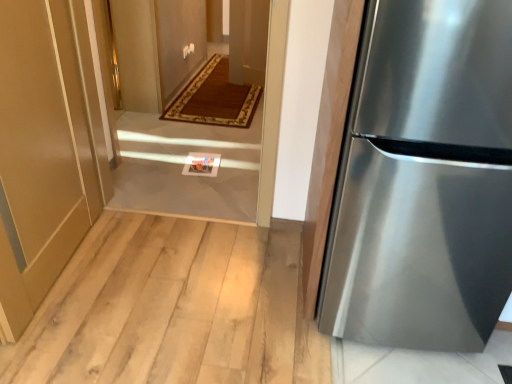
The width and height of the screenshot is (512, 384). Describe the element at coordinates (47, 147) in the screenshot. I see `matte gold door at lower left` at that location.

Image resolution: width=512 pixels, height=384 pixels. Find the location of `matte gold door at lower left`. matte gold door at lower left is located at coordinates (47, 147).

How many degrees apart are the facing directions of matte gold door at lower left and stainless steel refrigerator at right?

The angle between the facing direction of matte gold door at lower left and the facing direction of stainless steel refrigerator at right is 90.8 degrees.

In terms of size, does matte gold door at lower left appear bigger or smaller than stainless steel refrigerator at right?

In the image, matte gold door at lower left appears to be smaller than stainless steel refrigerator at right.

Consider the image. Is matte gold door at lower left not near stainless steel refrigerator at right?

Yes, matte gold door at lower left is far from stainless steel refrigerator at right.

Is the depth of matte gold door at lower left less than that of stainless steel refrigerator at right?

No, it is not.

Is white tile floor at center thinner than matte gold door at lower left?

In fact, white tile floor at center might be wider than matte gold door at lower left.

Is white tile floor at center taller than matte gold door at lower left?

In fact, white tile floor at center may be shorter than matte gold door at lower left.

Between stainless steel refrigerator at right and white tile floor at center, which one appears on the left side from the viewer's perspective?

white tile floor at center is more to the left.

Which of these two, stainless steel refrigerator at right or white tile floor at center, is thinner?

white tile floor at center is thinner.

Is stainless steel refrigerator at right facing away from white tile floor at center?

No, white tile floor at center is not at the back of stainless steel refrigerator at right.

Who is taller, stainless steel refrigerator at right or white tile floor at center?

Standing taller between the two is stainless steel refrigerator at right.

Is stainless steel refrigerator at right shorter than matte gold door at lower left?

Incorrect, the height of stainless steel refrigerator at right does not fall short of that of matte gold door at lower left.

Is matte gold door at lower left surrounded by stainless steel refrigerator at right?

No, matte gold door at lower left is located outside of stainless steel refrigerator at right.

Identify the location of door above the stainless steel refrigerator at right (from the image's perspective). (47, 147).

What are the coordinates of `refrigerator in front of the white tile floor at center` in the screenshot? It's located at (424, 180).

How different are the orientations of white tile floor at center and stainless steel refrigerator at right in degrees?

0.274 degrees.

Does white tile floor at center touch stainless steel refrigerator at right?

No, white tile floor at center is not touching stainless steel refrigerator at right.

Can you confirm if matte gold door at lower left is shorter than white tile floor at center?

Incorrect, the height of matte gold door at lower left does not fall short of that of white tile floor at center.

Is matte gold door at lower left positioned beyond the bounds of white tile floor at center?

Yes, matte gold door at lower left is located beyond the bounds of white tile floor at center.

Are matte gold door at lower left and white tile floor at center far apart?

matte gold door at lower left is actually quite close to white tile floor at center.

Based on the photo, can you tell me how much matte gold door at lower left and white tile floor at center differ in facing direction?

The angular difference between matte gold door at lower left and white tile floor at center is 90.5 degrees.

Locate an element on the screen. This screenshot has width=512, height=384. refrigerator that is below the matte gold door at lower left (from the image's perspective) is located at coordinates (424, 180).

Where is `corridor beneath the matte gold door at lower left (from a real-world perspective)`? Image resolution: width=512 pixels, height=384 pixels. corridor beneath the matte gold door at lower left (from a real-world perspective) is located at coordinates (196, 174).

When comparing their distances from stainless steel refrigerator at right, does matte gold door at lower left or white tile floor at center seem further?

matte gold door at lower left.

Considering their positions, is stainless steel refrigerator at right positioned closer to white tile floor at center than matte gold door at lower left?

matte gold door at lower left.

Based on the photo, based on their spatial positions, is stainless steel refrigerator at right or white tile floor at center further from matte gold door at lower left?

Based on the image, stainless steel refrigerator at right appears to be further to matte gold door at lower left.

Considering their positions, is white tile floor at center positioned further to matte gold door at lower left than stainless steel refrigerator at right?

stainless steel refrigerator at right lies further to matte gold door at lower left than the other object.

Looking at this image, estimate the real-world distances between objects in this image. Which object is closer to stainless steel refrigerator at right, white tile floor at center or matte gold door at lower left?

white tile floor at center is closer to stainless steel refrigerator at right.

Estimate the real-world distances between objects in this image. Which object is further from white tile floor at center, matte gold door at lower left or stainless steel refrigerator at right?

stainless steel refrigerator at right.

At what (x,y) coordinates should I click in order to perform the action: click on corridor between matte gold door at lower left and stainless steel refrigerator at right. Please return your answer as a coordinate pair (x, y). Image resolution: width=512 pixels, height=384 pixels. Looking at the image, I should click on (196, 174).